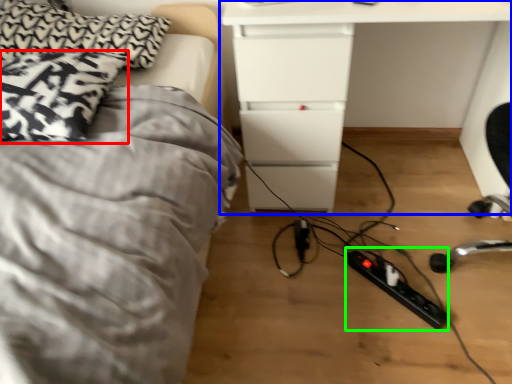
Question: Estimate the real-world distances between objects in this image. Which object is closer to pillow (highlighted by a red box), table (highlighted by a blue box) or extension cord (highlighted by a green box)?

Choices:
 (A) table
 (B) extension cord

Answer: (A)